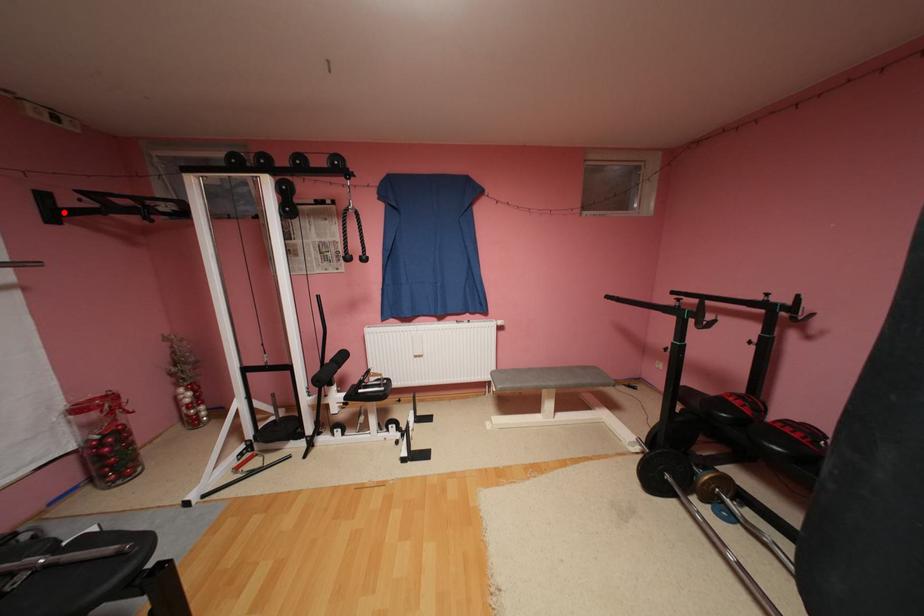
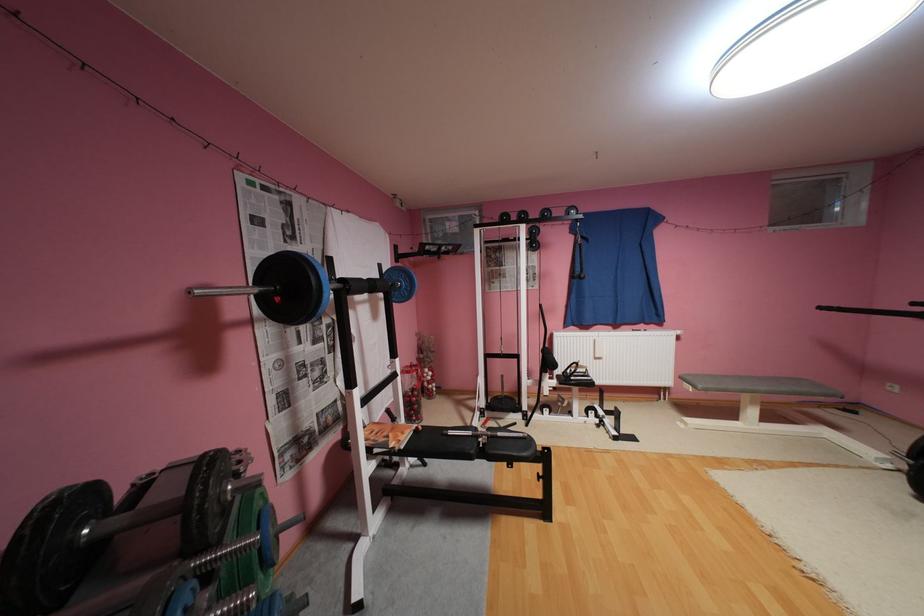
Find the pixel in the second image that matches the highlighted location in the first image.

(407, 256)